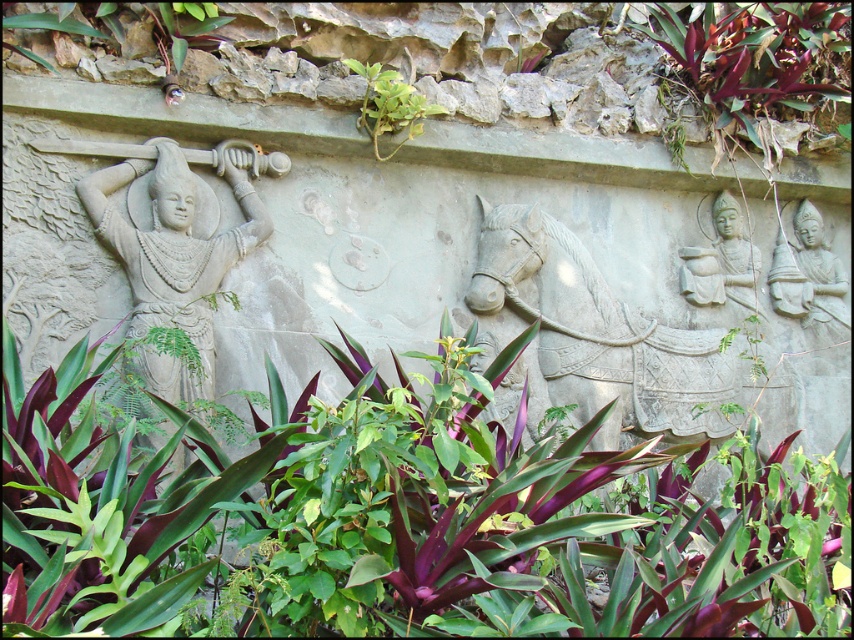
Question: Which point is farther to the camera?

Choices:
 (A) gray stone statue at left
 (B) green leafy plant at upper center
 (C) purple leafy plant at upper left
 (D) purple leafy plant at upper right

Answer: (D)

Question: Can you confirm if gray stone statue at left is positioned to the left of purple leafy plant at upper left?

Choices:
 (A) yes
 (B) no

Answer: (A)

Question: Is purple leafy plant at center thinner than gray stone statue at left?

Choices:
 (A) yes
 (B) no

Answer: (B)

Question: Which is nearer to the green leafy plant at upper center?

Choices:
 (A) gray stone statue at left
 (B) gray stone statue at upper right
 (C) gray stone statue at center right
 (D) purple leafy plant at upper left

Answer: (D)

Question: Which point is farther from the camera taking this photo?

Choices:
 (A) (826, 278)
 (B) (759, 308)

Answer: (A)

Question: Does gray stone statue at left appear on the right side of green leafy plant at upper center?

Choices:
 (A) yes
 (B) no

Answer: (B)